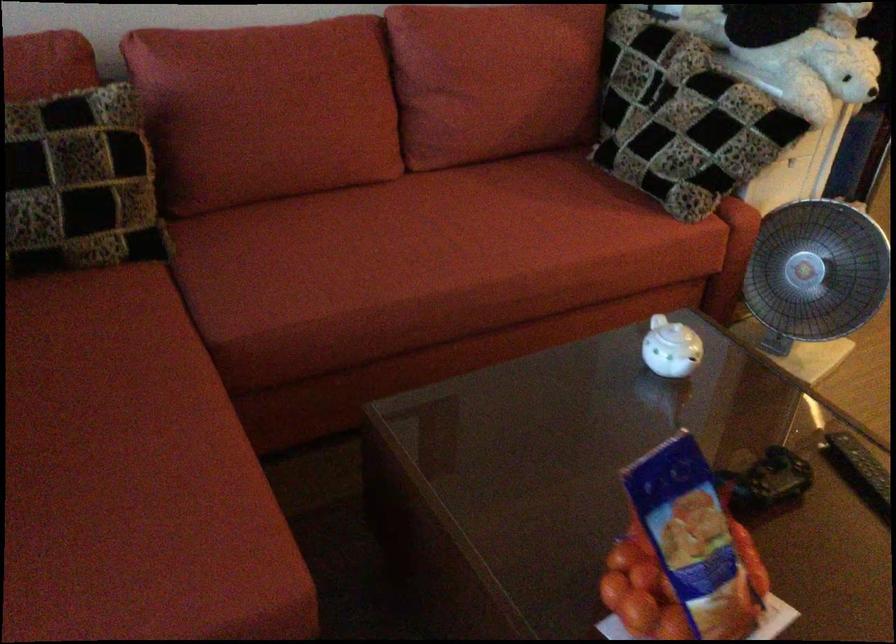
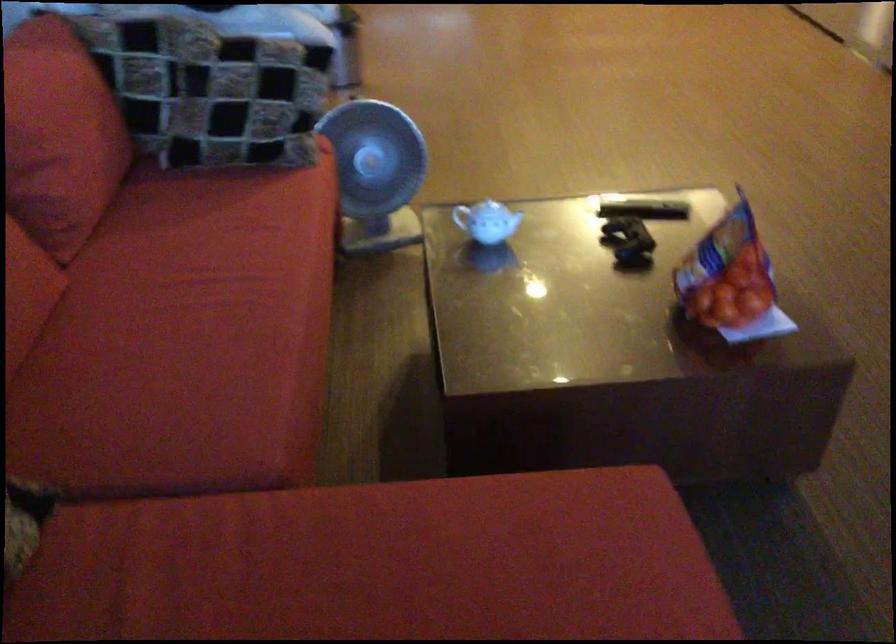
Locate, in the second image, the point that corresponds to point (366, 240) in the first image.

(192, 330)